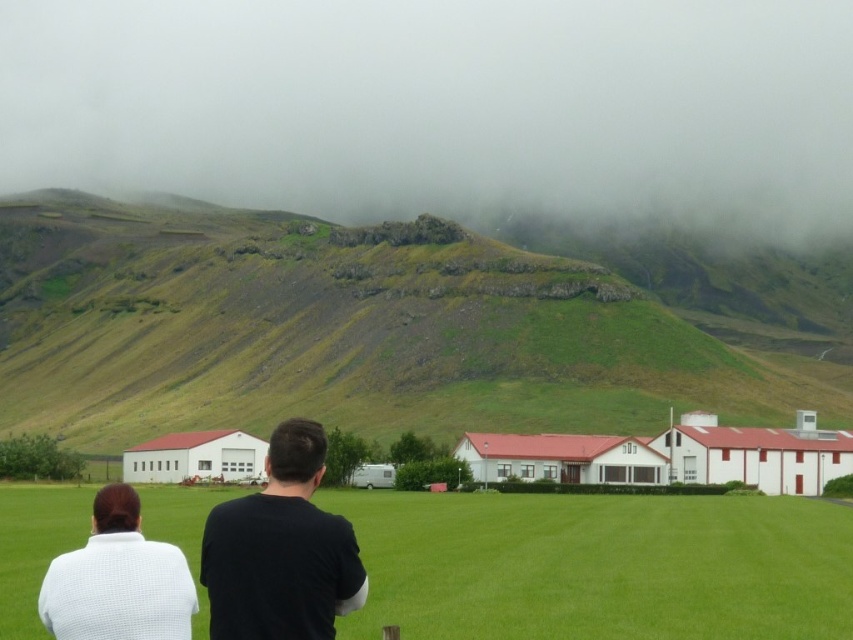
Question: Which point is closer to the camera?

Choices:
 (A) black matte shirt at center
 (B) white textured sweater at lower left
 (C) green grassy hillside at center
 (D) foggy misty hillside at upper center

Answer: (B)

Question: Can you confirm if green grassy hillside at center is bigger than black matte shirt at center?

Choices:
 (A) no
 (B) yes

Answer: (B)

Question: Which of the following is the farthest from the observer?

Choices:
 (A) green grass field at lower center
 (B) black matte shirt at center
 (C) white textured sweater at lower left

Answer: (A)

Question: Observing the image, what is the correct spatial positioning of green grass field at lower center in reference to white textured sweater at lower left?

Choices:
 (A) above
 (B) below

Answer: (B)

Question: Which object appears farthest from the camera in this image?

Choices:
 (A) black matte shirt at center
 (B) green grass field at lower center
 (C) white textured sweater at lower left

Answer: (B)

Question: Does foggy misty hillside at upper center appear on the right side of black matte shirt at center?

Choices:
 (A) yes
 (B) no

Answer: (B)